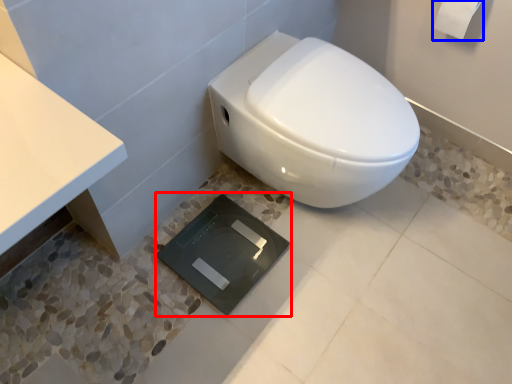
Question: Among these objects, which one is nearest to the camera, pad (highlighted by a red box) or toilet paper (highlighted by a blue box)?

Choices:
 (A) pad
 (B) toilet paper

Answer: (B)